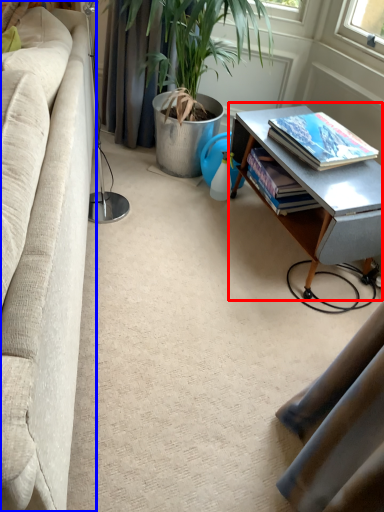
Question: Which point is further to the camera, table (highlighted by a red box) or studio couch (highlighted by a blue box)?

Choices:
 (A) table
 (B) studio couch

Answer: (A)